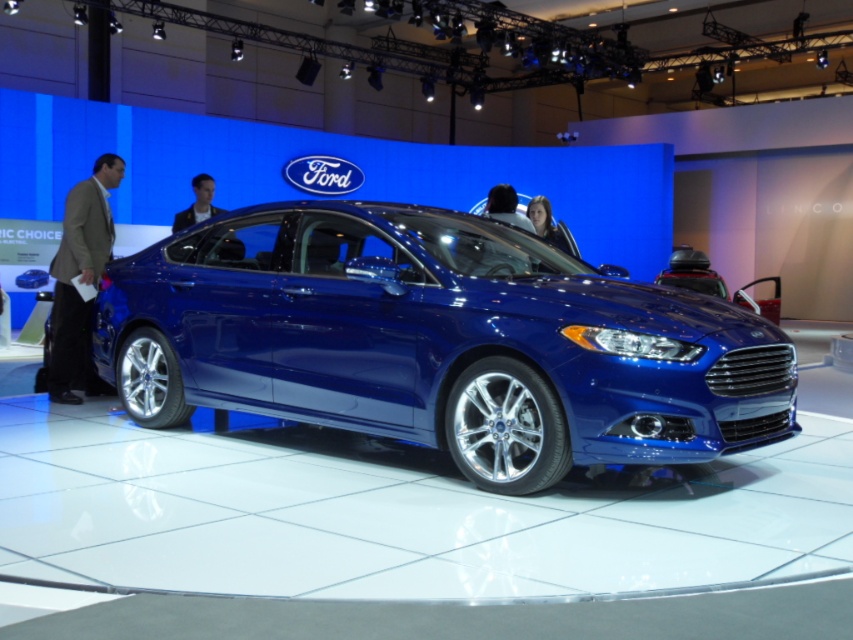
Is glossy metallic car at center further to the viewer compared to brown suit at left?

No, glossy metallic car at center is in front of brown suit at left.

Does point (235, 330) come farther from viewer compared to point (97, 388)?

No, it is not.

The image size is (853, 640). I want to click on glossy metallic car at center, so click(x=437, y=340).